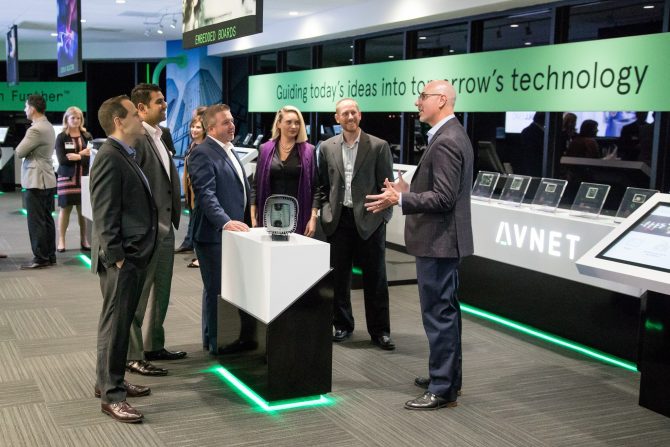
You are a GUI agent. You are given a task and a screenshot of the screen. Output one action in this format:
    pyautogui.click(x=<x>, y=<y>)
    Task: Click on the neon green light
    This screenshot has width=670, height=447.
    Given the screenshot: What is the action you would take?
    pyautogui.click(x=309, y=401)